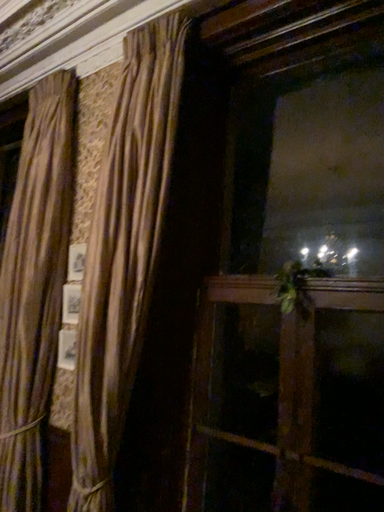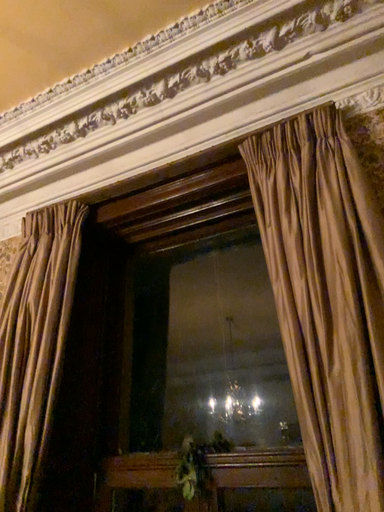
Question: Which way did the camera rotate in the video?

Choices:
 (A) rotated upward
 (B) rotated downward

Answer: (A)